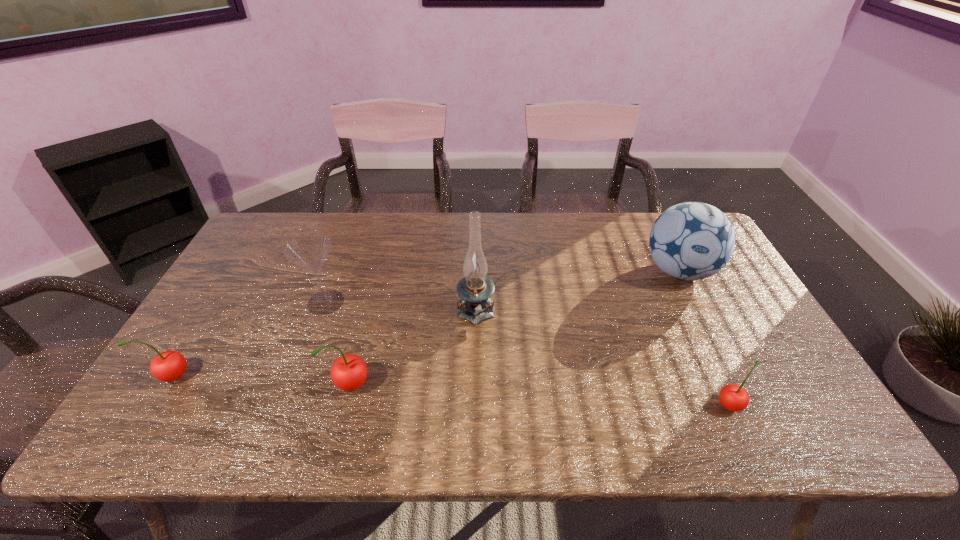
Please determine a free point for an extra cherry to ensure balance. Please provide its 2D coordinates. Your answer should be formatted as a tuple, i.e. [(x, y)], where the tuple contains the x and y coordinates of a point satisfying the conditions above.

[(537, 395)]